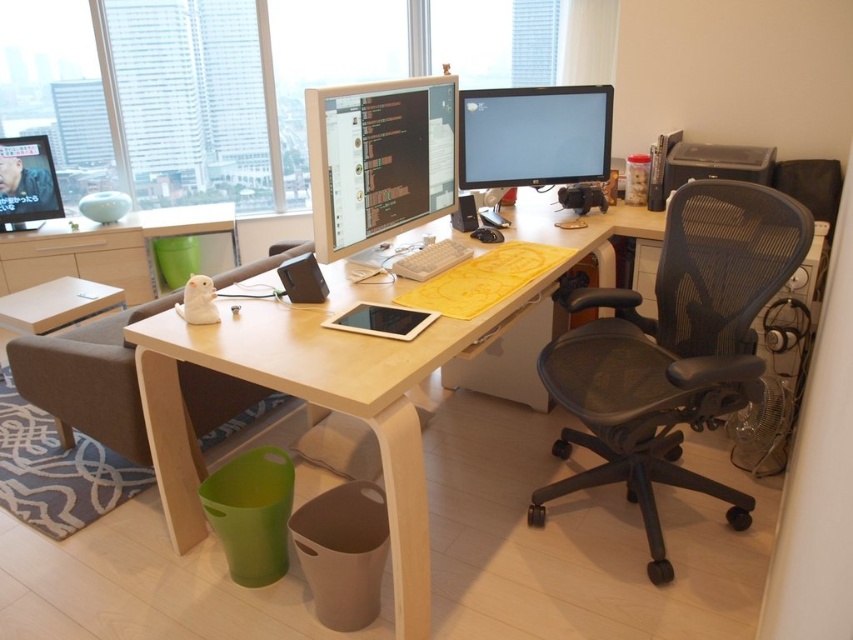
Can you confirm if black mesh swivel chair at lower center is shorter than matte black monitor at upper left?

No.

Between black mesh swivel chair at lower center and matte black monitor at upper left, which one is positioned lower?

Positioned lower is black mesh swivel chair at lower center.

Who is more distant from viewer, (86, 372) or (21, 218)?

Point (21, 218)

The height and width of the screenshot is (640, 853). In order to click on black mesh swivel chair at lower center in this screenshot , I will do `click(90, 380)`.

Who is more forward, (x=556, y=380) or (x=544, y=134)?

Point (x=556, y=380) is in front.

In order to click on black mesh office chair at right in this screenshot , I will do `click(674, 349)`.

Where is `light wood/wooden computer desk at center`? The height and width of the screenshot is (640, 853). light wood/wooden computer desk at center is located at coordinates (337, 387).

Between light wood/wooden computer desk at center and matte black monitor at upper left, which one appears on the right side from the viewer's perspective?

Positioned to the right is light wood/wooden computer desk at center.

Between point (320, 305) and point (9, 177), which one is positioned in front?

Point (320, 305)

Where is `light wood/wooden computer desk at center`? Image resolution: width=853 pixels, height=640 pixels. light wood/wooden computer desk at center is located at coordinates (337, 387).